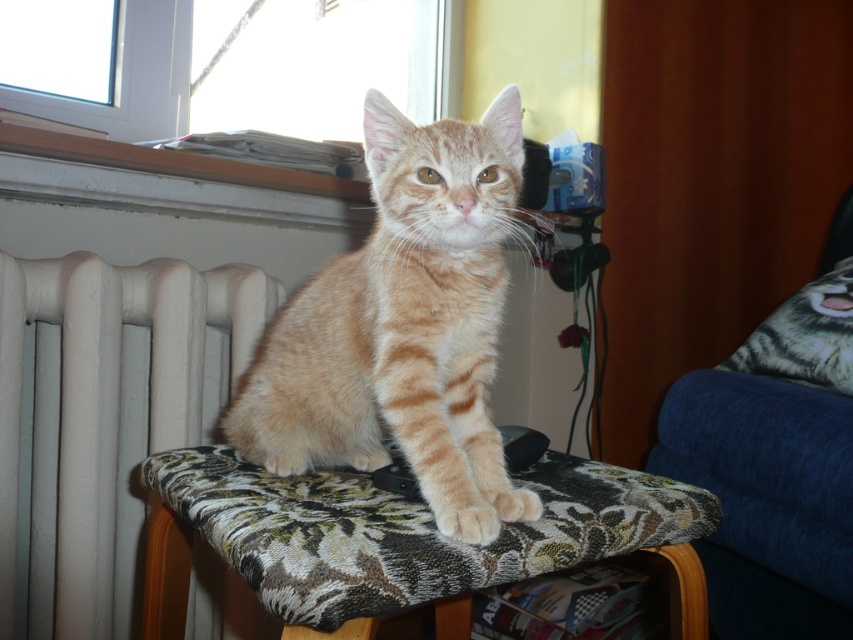
Does orange tabby cat at center have a greater width compared to blue fabric armchair at right?

Yes, orange tabby cat at center is wider than blue fabric armchair at right.

Can you confirm if orange tabby cat at center is shorter than blue fabric armchair at right?

Indeed, orange tabby cat at center has a lesser height compared to blue fabric armchair at right.

Does point (280, 394) lie behind point (808, 560)?

No.

Find the location of a particular element. The image size is (853, 640). orange tabby cat at center is located at coordinates (403, 326).

Is blue fabric armchair at right in front of tabby fur pillow at right?

Yes, it is in front of tabby fur pillow at right.

Is point (726, 595) farther from camera compared to point (848, 307)?

No, (726, 595) is in front of (848, 307).

Find the location of `blue fabric armchair at right`. blue fabric armchair at right is located at coordinates (766, 499).

Can you confirm if white painted wood at upper left is bigger than tabby fur pillow at right?

Actually, white painted wood at upper left might be smaller than tabby fur pillow at right.

Does white painted wood at upper left appear under tabby fur pillow at right?

No.

Who is more forward, (44, 132) or (802, 378)?

Positioned in front is point (44, 132).

At what (x,y) coordinates should I click in order to perform the action: click on white painted wood at upper left. Please return your answer as a coordinate pair (x, y). This screenshot has width=853, height=640. Looking at the image, I should click on (172, 180).